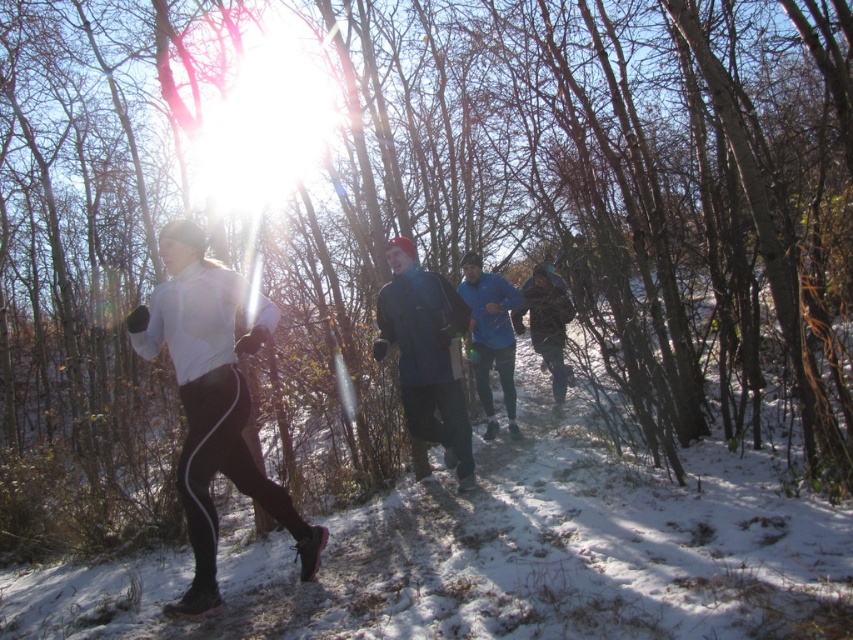
Question: Where is white matte running suit at center located in relation to blue fleece jacket at center in the image?

Choices:
 (A) right
 (B) left

Answer: (B)

Question: Where is white matte running suit at center located in relation to camouflage jacket at center in the image?

Choices:
 (A) above
 (B) below

Answer: (B)

Question: Estimate the real-world distances between objects in this image. Which object is closer to the white matte running suit at center?

Choices:
 (A) blue fabric jacket at center
 (B) camouflage jacket at center

Answer: (A)

Question: Which point is closer to the camera?

Choices:
 (A) blue fleece jacket at center
 (B) camouflage jacket at center
 (C) blue fabric jacket at center
 (D) white matte running suit at center

Answer: (D)

Question: Among these points, which one is farthest from the camera?

Choices:
 (A) [447, 296]
 (B) [201, 230]
 (C) [531, 282]

Answer: (C)

Question: Where is white matte running suit at center located in relation to blue fleece jacket at center in the image?

Choices:
 (A) left
 (B) right

Answer: (A)